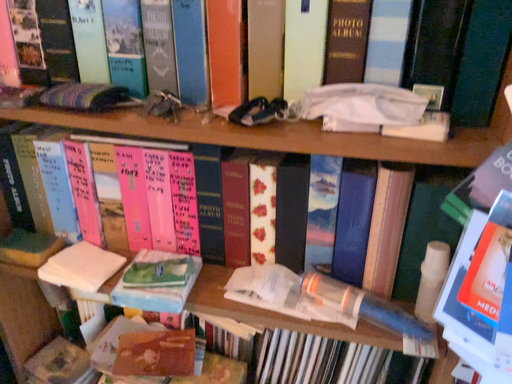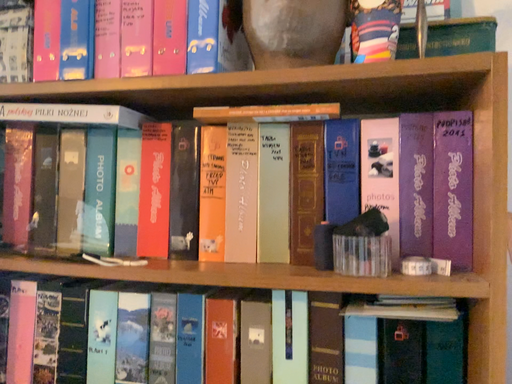
Question: How did the camera likely rotate when shooting the video?

Choices:
 (A) rotated downward
 (B) rotated upward

Answer: (B)